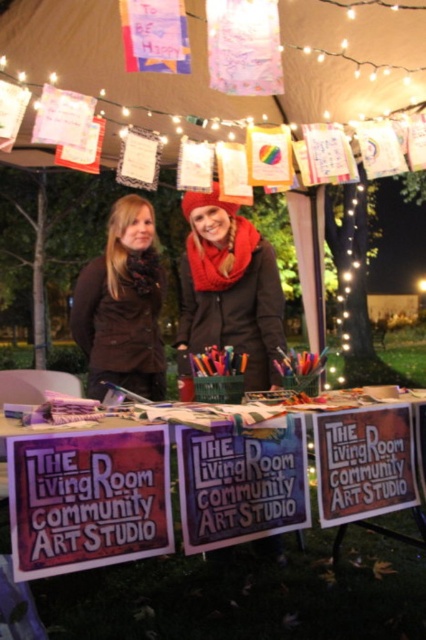
Question: Among these objects, which one is nearest to the camera?

Choices:
 (A) red scarf at center
 (B) paper banners at upper center
 (C) brown fuzzy vest at left
 (D) metallic purple sign at center

Answer: (D)

Question: Does metallic purple sign at center appear over paper banners at upper center?

Choices:
 (A) yes
 (B) no

Answer: (B)

Question: Considering the real-world distances, which object is farthest from the metallic purple sign at center?

Choices:
 (A) purple paper sign at center
 (B) red scarf at center
 (C) brown fuzzy vest at left

Answer: (C)

Question: Which of the following is the farthest from the observer?

Choices:
 (A) (11, 452)
 (B) (319, 96)
 (C) (97, 394)

Answer: (B)

Question: Does purple paper sign at center appear on the right side of brown fuzzy vest at left?

Choices:
 (A) no
 (B) yes

Answer: (B)

Question: Can you confirm if purple paper sign at center is smaller than red scarf at center?

Choices:
 (A) no
 (B) yes

Answer: (B)